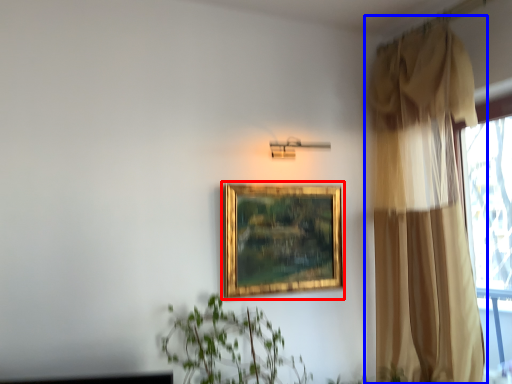
Question: Among these objects, which one is nearest to the camera, picture frame (highlighted by a red box) or curtain (highlighted by a blue box)?

Choices:
 (A) picture frame
 (B) curtain

Answer: (B)